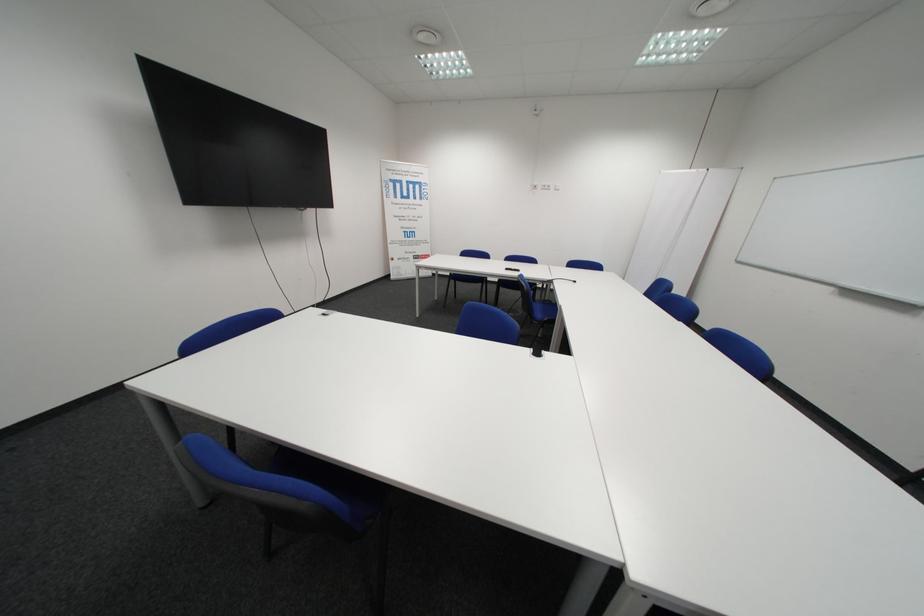
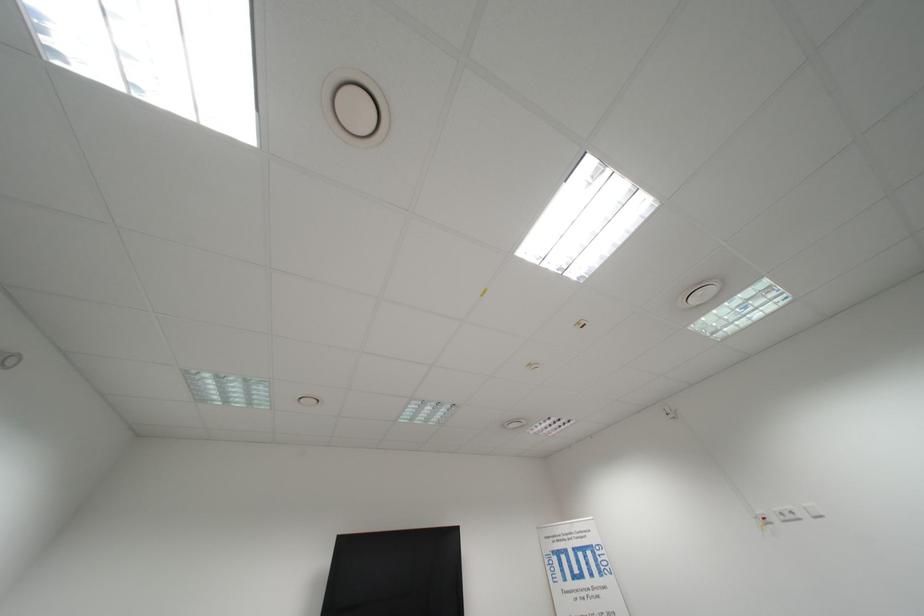
Where in the second image is the point corresponding to the point at 554,188 from the first image?

(796, 519)